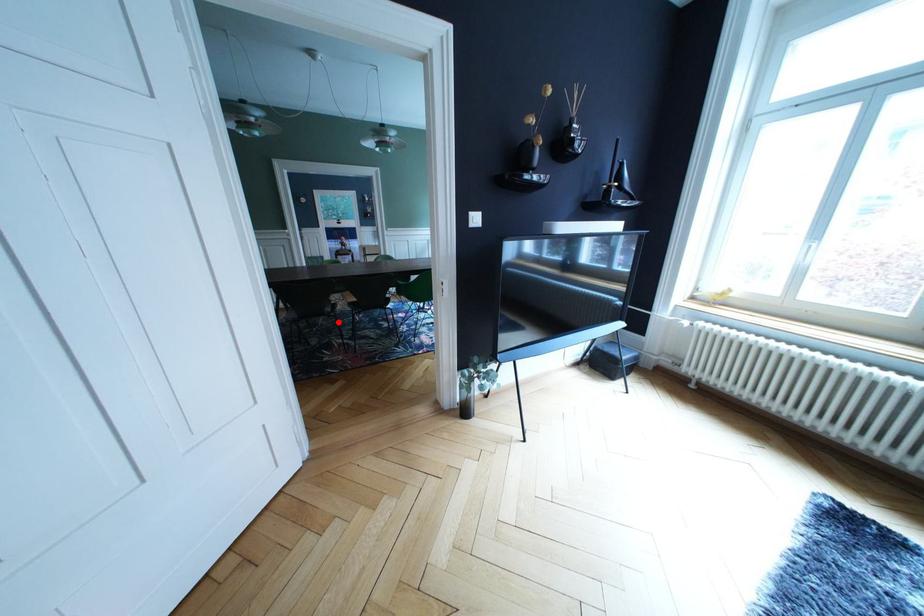
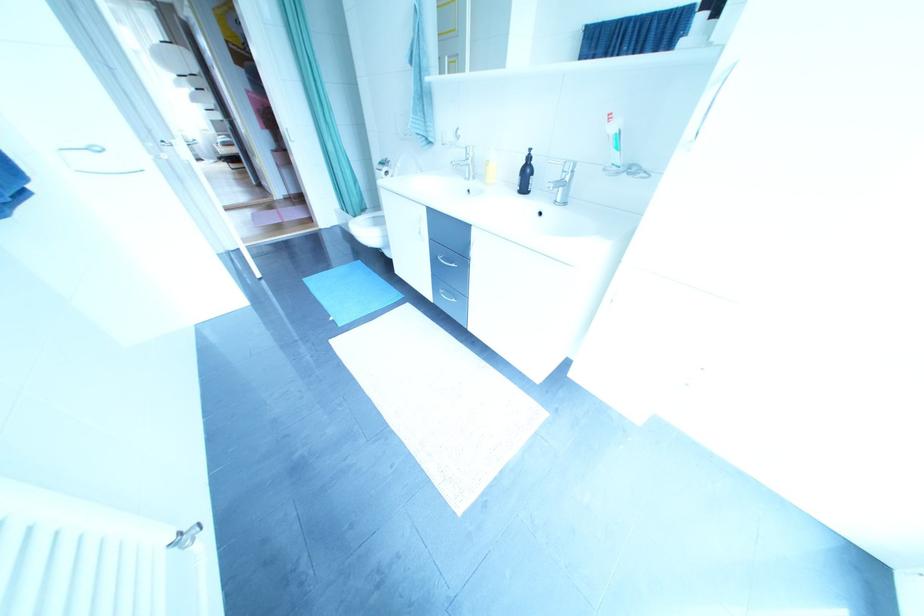
Question: I am providing you with two images of the same scene from different viewpoints. A red point is marked on the first image. Can you still see the location of the red point in image 2?

Choices:
 (A) Yes
 (B) No

Answer: (B)